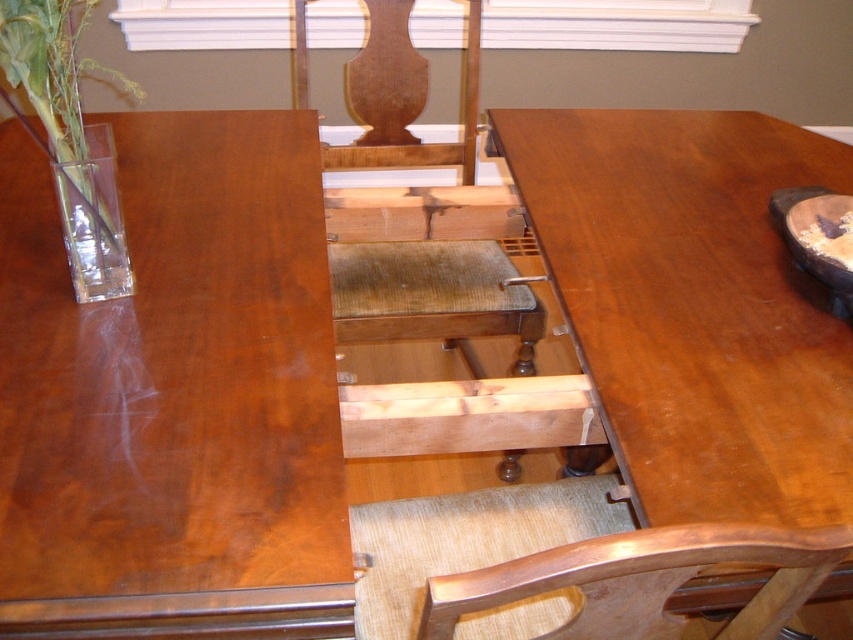
You are sitting at the wooden dining table and want to place a small plant on the clear glass vase at left. However, there is a wooden textured chair back at center in the way. Can you move the vase to the right to avoid the chair back?

The wooden textured chair back at center is positioned under the clear glass vase at left, so moving the vase to the right would allow it to be placed away from the chair back.

You are a guest at a dinner party and need to place your coat on the table that is shorter. Which table should you choose between the glossy wood table at left and the wooden at center?

The glossy wood table at left is not as tall as the wooden at center, so you should place your coat on the glossy wood table at left since it is shorter.